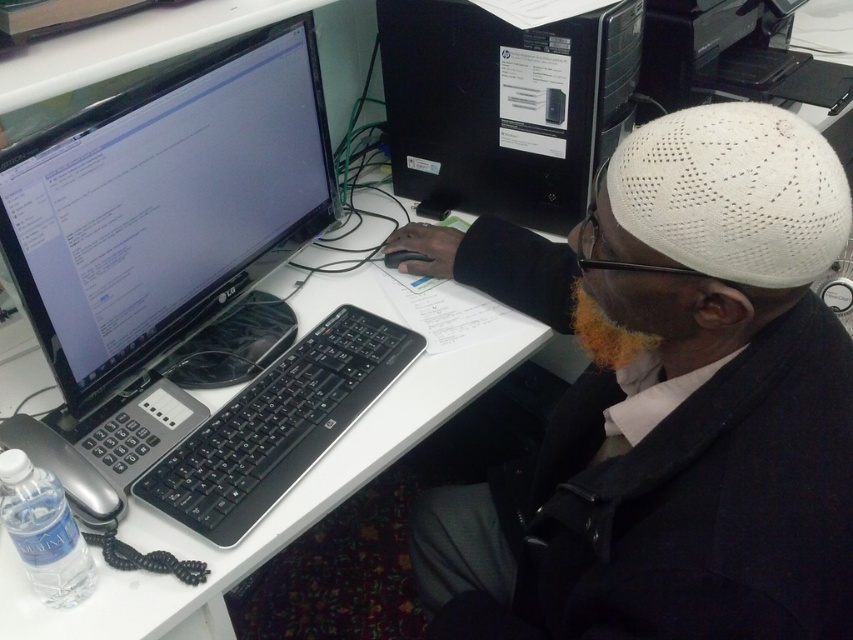
Question: Is white knit cap at upper right smaller than white plastic table at center?

Choices:
 (A) no
 (B) yes

Answer: (B)

Question: Which object appears closest to the camera in this image?

Choices:
 (A) black plastic keyboard at center
 (B) white plastic table at center
 (C) black plastic computer tower at center
 (D) white knit cap at upper right

Answer: (D)

Question: Which point appears closest to the camera in this image?

Choices:
 (A) (9, 412)
 (B) (518, 97)
 (C) (338, 369)
 (D) (235, 145)

Answer: (A)

Question: Which object is positioned farthest from the black plastic keyboard at center?

Choices:
 (A) black glossy monitor at upper left
 (B) white knit cap at upper right
 (C) white plastic table at center
 (D) black plastic computer tower at center

Answer: (D)

Question: Observing the image, what is the correct spatial positioning of white knit cap at upper right in reference to black glossy monitor at upper left?

Choices:
 (A) left
 (B) right

Answer: (B)

Question: Is black plastic computer tower at center below black plastic keyboard at center?

Choices:
 (A) yes
 (B) no

Answer: (B)